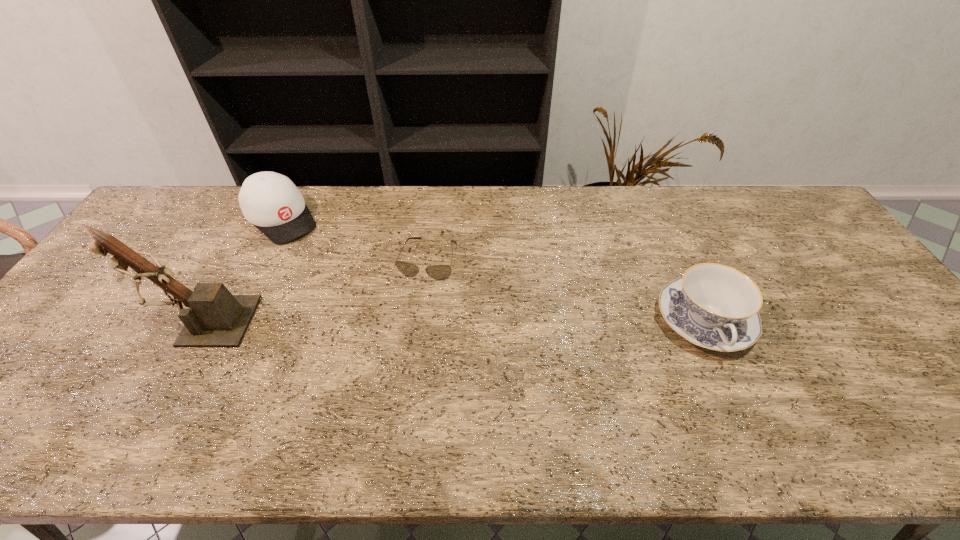
The image size is (960, 540). I want to click on free spot on the desktop that is between the figurine and the second shortest object and is positioned on the front-facing side of the shortest object, so click(409, 321).

The width and height of the screenshot is (960, 540). I want to click on vacant spot on the desktop that is between the figurine and the chinaware and is positioned on the front-facing side of the baseball cap, so click(381, 321).